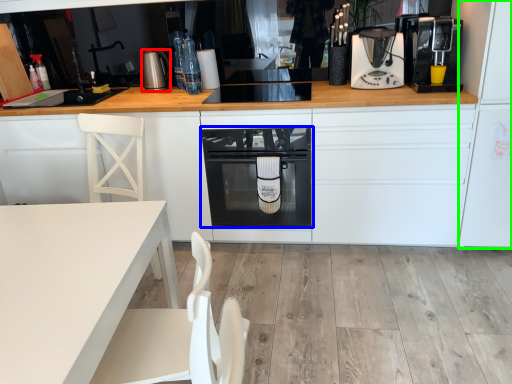
Question: Considering the real-world distances, which object is closest to kitchen appliance (highlighted by a red box)? home appliance (highlighted by a blue box) or fridge (highlighted by a green box).

Choices:
 (A) home appliance
 (B) fridge

Answer: (A)